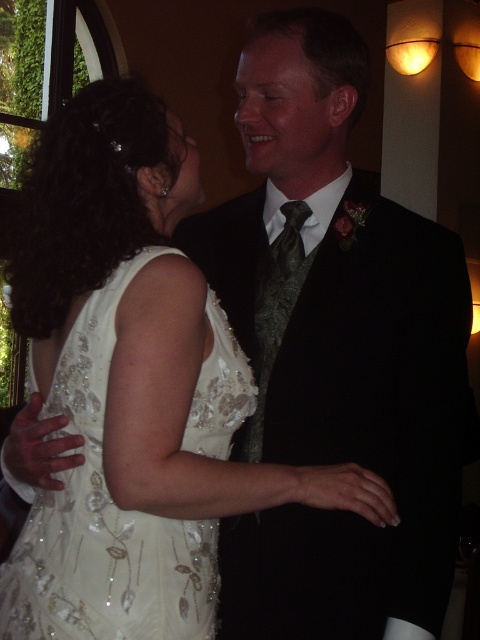
You are a photographer at a wedding reception. You need to capture a photo of the black satin suit at center and the sequined satin dress at center. Which one is positioned to the right of the other?

The black satin suit at center is positioned on the right side of sequined satin dress at center, so the black satin suit at center is to the right of the sequined satin dress at center.

Based on the photo, you are a photographer positioned at the front of the room. You need to adjust your camera focus to capture both the black satin suit at center and the green satin tie at center clearly. Which object should you focus on first to ensure both are in focus?

You should focus on the black satin suit at center first since it is closer to the viewer than the green satin tie at center. By focusing on the closer object, the depth of field will naturally include the farther object in acceptable focus.

Based on the photo, you are a photographer at a wedding event. You need to position a camera to capture both the white sequined dress at center and the green satin tie at center in the same frame. Which object should you focus on first to ensure both are in focus?

The white sequined dress at center has a greater height compared to the green satin tie at center, so you should focus on the white sequined dress at center first to ensure both are in focus.